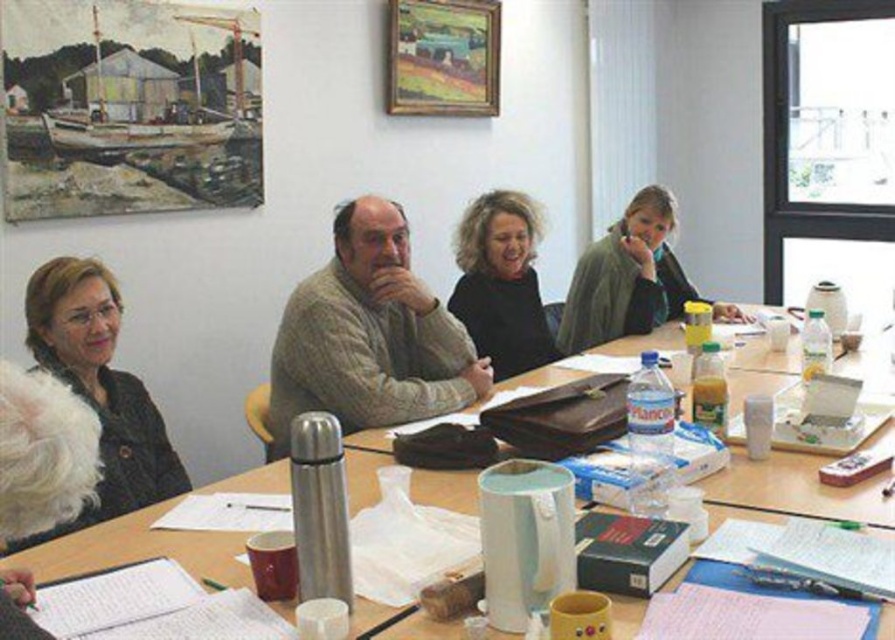
Question: Can you confirm if black fuzzy jacket at lower left is positioned above black sweater at center?

Choices:
 (A) no
 (B) yes

Answer: (A)

Question: Among these objects, which one is nearest to the camera?

Choices:
 (A) black sweater at center
 (B) white paper at upper left
 (C) black fuzzy jacket at lower left
 (D) light brown sweater at center

Answer: (B)

Question: Considering the real-world distances, which object is farthest from the light brown sweater at center?

Choices:
 (A) black sweater at center
 (B) black fuzzy jacket at lower left
 (C) white paper at upper left

Answer: (B)

Question: Can you confirm if black fuzzy jacket at lower left is positioned to the left of black sweater at center?

Choices:
 (A) no
 (B) yes

Answer: (B)

Question: Which point is farther to the camera?

Choices:
 (A) (175, 481)
 (B) (510, 337)
 (C) (428, 632)

Answer: (B)

Question: Can you confirm if white paper at upper left is bigger than black fuzzy jacket at lower left?

Choices:
 (A) no
 (B) yes

Answer: (B)